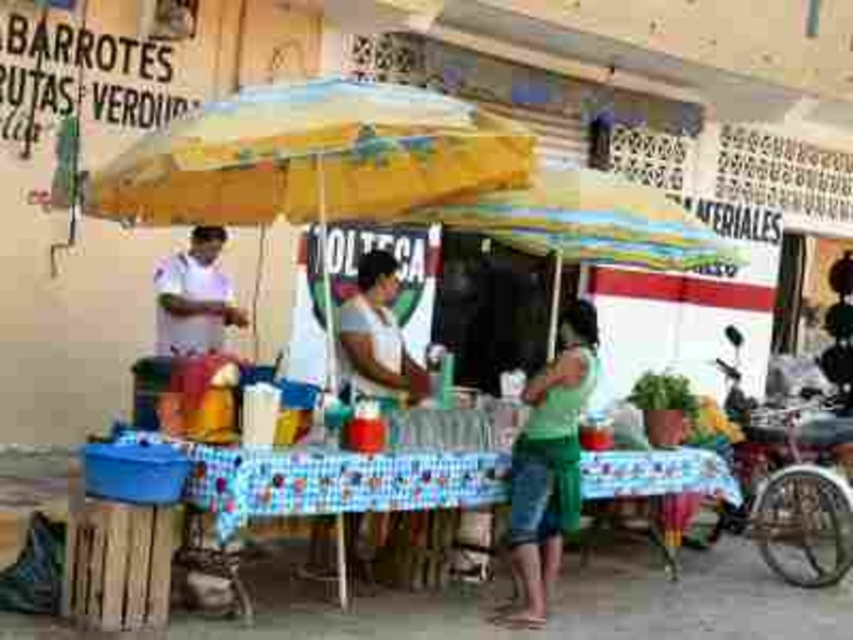
Who is positioned more to the left, yellow fabric umbrella at center or blue checkered tablecloth at center?

Positioned to the left is yellow fabric umbrella at center.

Is yellow fabric umbrella at center to the right of blue checkered tablecloth at center from the viewer's perspective?

In fact, yellow fabric umbrella at center is to the left of blue checkered tablecloth at center.

At what (x,y) coordinates should I click in order to perform the action: click on yellow fabric umbrella at center. Please return your answer as a coordinate pair (x, y). The height and width of the screenshot is (640, 853). Looking at the image, I should click on (312, 156).

You are a GUI agent. You are given a task and a screenshot of the screen. Output one action in this format:
    pyautogui.click(x=<x>, y=<y>)
    Task: Click on the yellow fabric umbrella at center
    
    Given the screenshot: What is the action you would take?
    pyautogui.click(x=312, y=156)

Can you confirm if yellow fabric umbrella at center is positioned above white cotton shirt at center?

Yes.

Does yellow fabric umbrella at center have a greater width compared to white cotton shirt at center?

Correct, the width of yellow fabric umbrella at center exceeds that of white cotton shirt at center.

Which is behind, point (265, 136) or point (222, 337)?

The point (222, 337) is behind.

Where is `yellow fabric umbrella at center`? This screenshot has height=640, width=853. yellow fabric umbrella at center is located at coordinates (312, 156).

Is point (642, 454) positioned in front of point (607, 257)?

Yes, it is in front of point (607, 257).

Is blue checkered tablecloth at center above multicolored fabric umbrella at center?

Incorrect, blue checkered tablecloth at center is not positioned above multicolored fabric umbrella at center.

Who is more distant from viewer, (218, 458) or (653, 188)?

The point (653, 188) is behind.

Where is `blue checkered tablecloth at center`? blue checkered tablecloth at center is located at coordinates (331, 480).